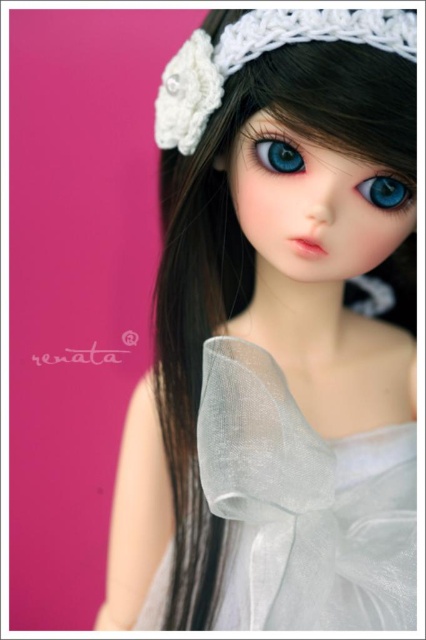
Question: Is translucent white fabric at center bigger than white crochet headscarf at upper center?

Choices:
 (A) no
 (B) yes

Answer: (B)

Question: Among these points, which one is nearest to the camera?

Choices:
 (A) (227, 35)
 (B) (397, 202)
 (C) (210, 480)
 (D) (265, 150)

Answer: (C)

Question: Among these objects, which one is nearest to the camera?

Choices:
 (A) translucent white fabric at center
 (B) blue glossy eye at center

Answer: (A)

Question: Can you confirm if translucent white fabric at center is positioned below blue glossy eye at center?

Choices:
 (A) no
 (B) yes

Answer: (B)

Question: Does translucent white fabric at center appear on the right side of white crochet headscarf at upper center?

Choices:
 (A) no
 (B) yes

Answer: (A)

Question: Which point appears closest to the camera in this image?

Choices:
 (A) (288, 477)
 (B) (305, 35)
 (C) (382, 180)
 (D) (288, 147)

Answer: (A)